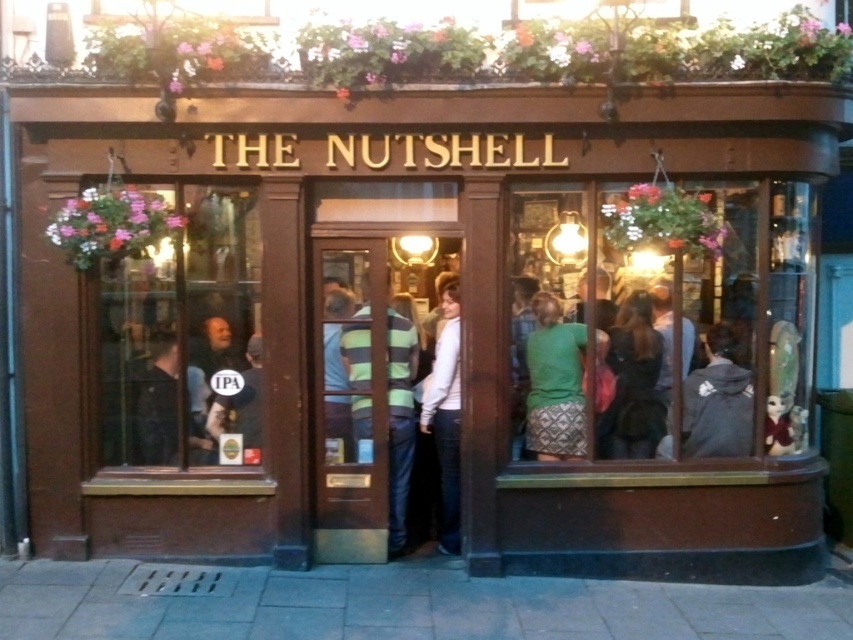
Which of these two, green textured sweater at center or green striped sweater at center, stands taller?

green striped sweater at center is taller.

Between point (550, 358) and point (325, 416), which one is positioned behind?

The point (550, 358) is more distant.

Where is `green textured sweater at center`? green textured sweater at center is located at coordinates (555, 384).

Does striped jersey at center have a greater width compared to white matte sweater at center?

Yes.

This screenshot has height=640, width=853. I want to click on striped jersey at center, so click(399, 422).

Locate an element on the screen. This screenshot has height=640, width=853. striped jersey at center is located at coordinates (399, 422).

Does dark fabric shirt at left appear over matte black signboard at lower left?

Incorrect, dark fabric shirt at left is not positioned above matte black signboard at lower left.

The image size is (853, 640). Find the location of `dark fabric shirt at left`. dark fabric shirt at left is located at coordinates (158, 404).